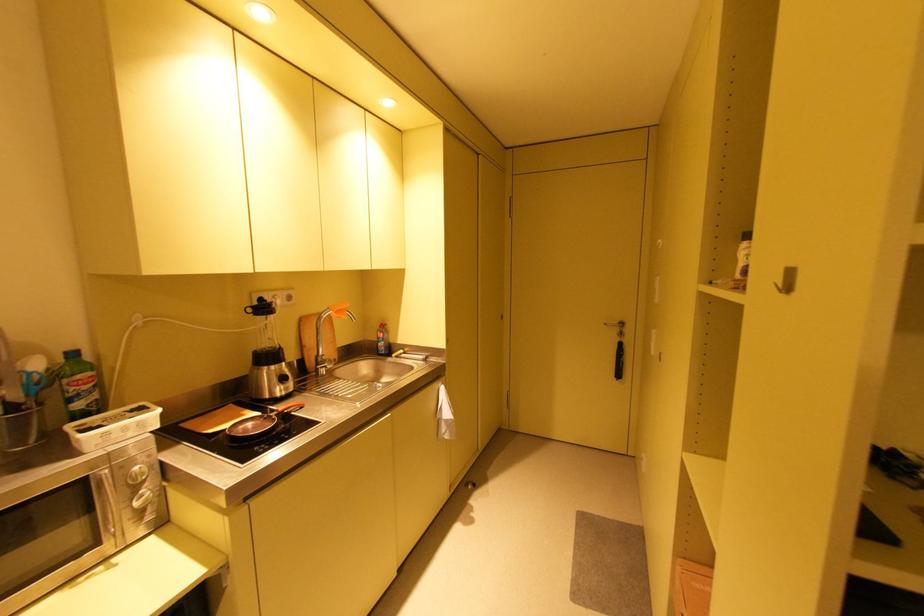
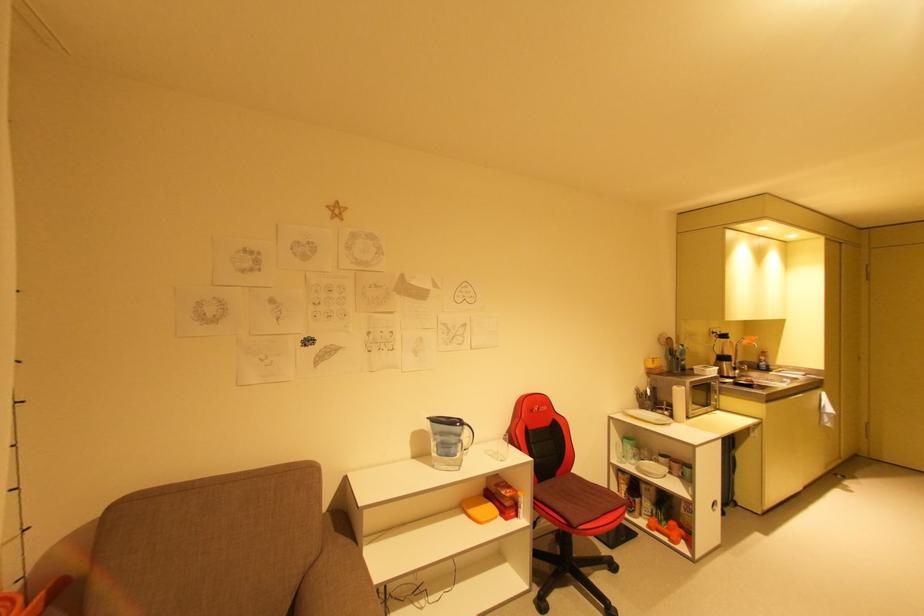
Locate, in the second image, the point that corresponds to point (394, 360) in the first image.

(776, 373)